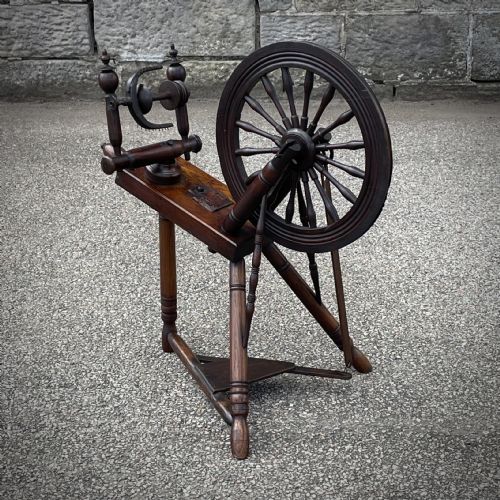
The image size is (500, 500). I want to click on light brown wood, so click(209, 181).